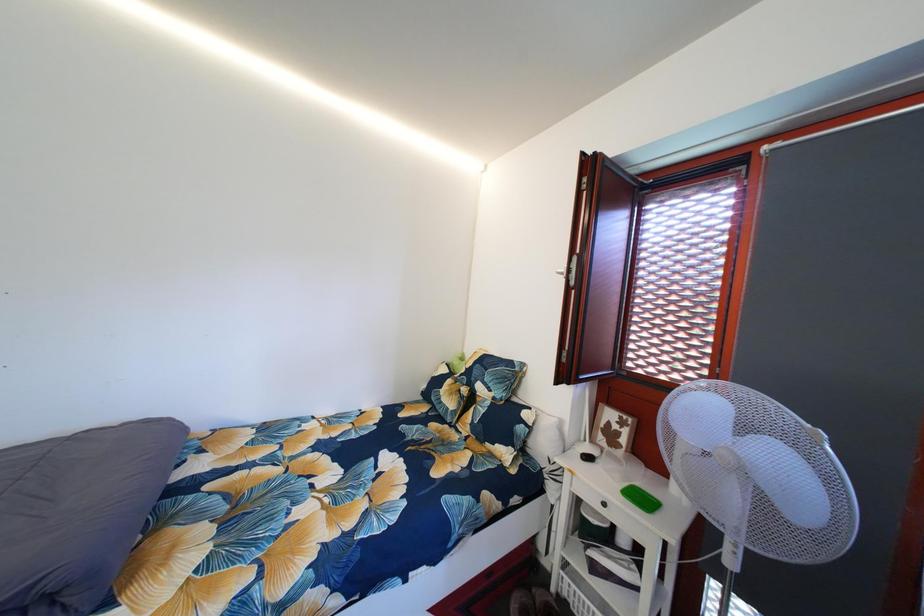
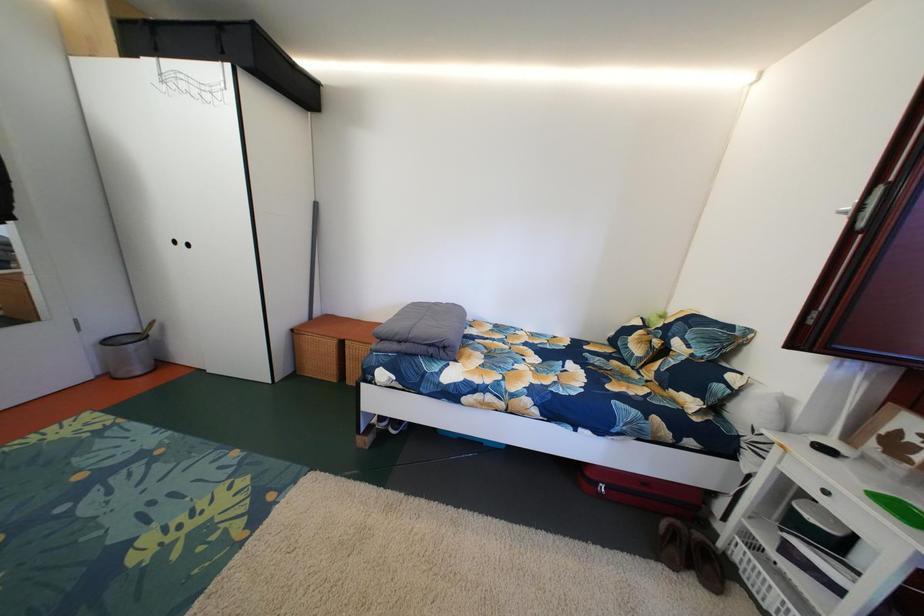
Question: The camera is either moving clockwise (left) or counter-clockwise (right) around the object. The first image is from the beginning of the video and the second image is from the end. Is the camera moving left or right when shooting the video?

Choices:
 (A) Left
 (B) Right

Answer: (B)